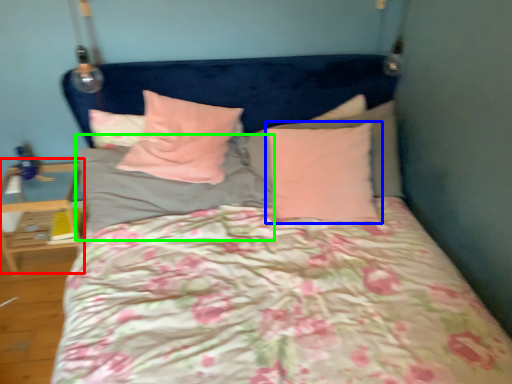
Question: Which is farther away from table (highlighted by a red box)? pillow (highlighted by a blue box) or pillow (highlighted by a green box)?

Choices:
 (A) pillow
 (B) pillow

Answer: (A)